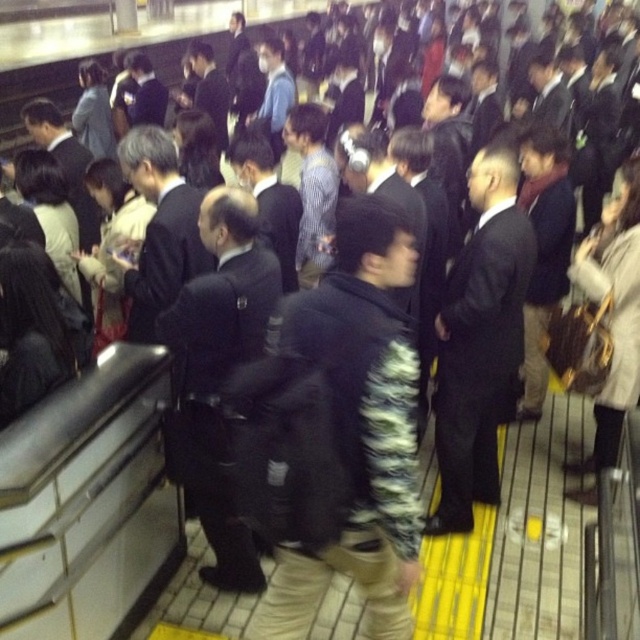
You are standing on the subway platform and notice a fluffy black jacket at center. If you want to move closer to it, which direction should you walk? Please provide your answer in terms of compass directions like north, south, east, west, northeast, etc., or relative directions like forward, backward, left, right, etc. Assume you are facing the direction of the train tracks.

Since the fluffy black jacket at center is located at the center of the platform, you should walk forward towards the center of the platform where the jacket is situated.

You are a commuter waiting on the subway platform. You notice a fluffy black jacket at center and a dark blue uniform at center. Which item is positioned lower relative to the other?

The fluffy black jacket at center is positioned lower than the dark blue uniform at center.

You are a commuter on a subway platform. You notice a fluffy black jacket at center and a black suit at center. Which one is closer to the ground?

The fluffy black jacket at center is below black suit at center, so it is closer to the ground.